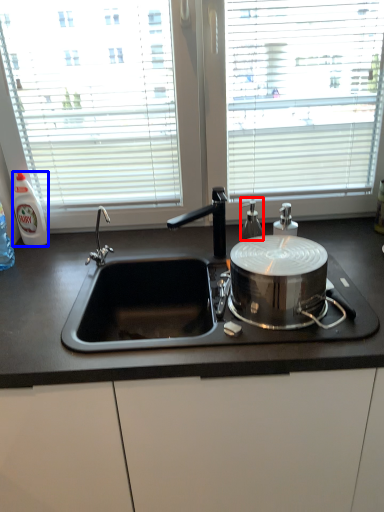
Question: Which object appears closest to the camera in this image, bottle (highlighted by a red box) or bottle (highlighted by a blue box)?

Choices:
 (A) bottle
 (B) bottle

Answer: (A)